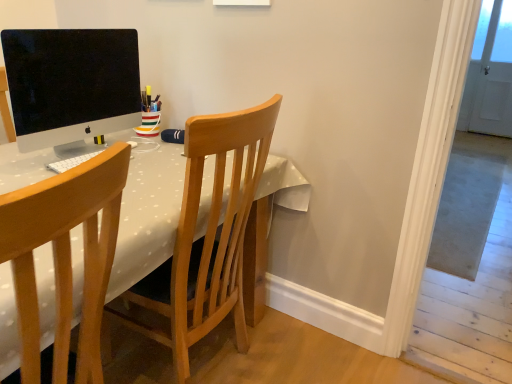
Question: Considering the relative sizes of white dotted fabric table at center and wooden chair at center, which is the 1th chair in back-to-front order, in the image provided, is white dotted fabric table at center thinner than wooden chair at center, which is the 1th chair in back-to-front order,?

Choices:
 (A) yes
 (B) no

Answer: (B)

Question: Is white dotted fabric table at center surrounding wooden chair at center, which is the 1th chair in back-to-front order?

Choices:
 (A) yes
 (B) no

Answer: (A)

Question: Considering the relative sizes of white dotted fabric table at center and wooden chair at center, marked as the 2th chair in a front-to-back arrangement, in the image provided, is white dotted fabric table at center bigger than wooden chair at center, marked as the 2th chair in a front-to-back arrangement,?

Choices:
 (A) no
 (B) yes

Answer: (B)

Question: From the image's perspective, does white dotted fabric table at center appear lower than wooden chair at center, marked as the 2th chair in a front-to-back arrangement?

Choices:
 (A) yes
 (B) no

Answer: (A)

Question: Is white dotted fabric table at center facing away from wooden chair at center, which is the 1th chair in back-to-front order?

Choices:
 (A) no
 (B) yes

Answer: (A)

Question: Is white dotted fabric table at center at the right side of wooden chair at center, marked as the 2th chair in a front-to-back arrangement?

Choices:
 (A) no
 (B) yes

Answer: (A)

Question: Is matte black monitor at upper left facing towards white dotted fabric table at center?

Choices:
 (A) yes
 (B) no

Answer: (B)

Question: Can you confirm if matte black monitor at upper left is smaller than white dotted fabric table at center?

Choices:
 (A) yes
 (B) no

Answer: (A)

Question: Does matte black monitor at upper left have a larger size compared to white dotted fabric table at center?

Choices:
 (A) no
 (B) yes

Answer: (A)

Question: Is matte black monitor at upper left further to camera compared to white dotted fabric table at center?

Choices:
 (A) no
 (B) yes

Answer: (B)

Question: Considering the relative sizes of matte black monitor at upper left and white dotted fabric table at center in the image provided, is matte black monitor at upper left shorter than white dotted fabric table at center?

Choices:
 (A) no
 (B) yes

Answer: (B)

Question: From a real-world perspective, is matte black monitor at upper left under white dotted fabric table at center?

Choices:
 (A) no
 (B) yes

Answer: (A)

Question: From the image's perspective, is white dotted fabric table at center beneath white matte keyboard at center?

Choices:
 (A) no
 (B) yes

Answer: (B)